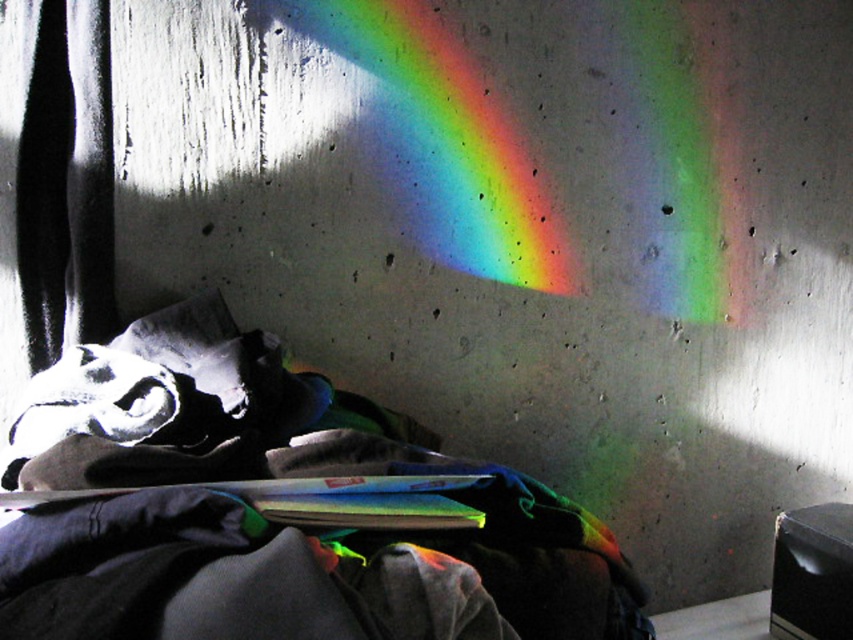
You are a GUI agent. You are given a task and a screenshot of the screen. Output one action in this format:
    pyautogui.click(x=<x>, y=<y>)
    Task: Click on the dark gray fabric at center
    This screenshot has height=640, width=853.
    Given the screenshot: What is the action you would take?
    pyautogui.click(x=265, y=509)

Is dark gray fabric at center positioned in front of rainbow spectrum at upper center?

Yes, it is.

Between point (0, 628) and point (583, 42), which one is positioned in front?

Positioned in front is point (0, 628).

Locate an element on the screen. This screenshot has width=853, height=640. dark gray fabric at center is located at coordinates (265, 509).